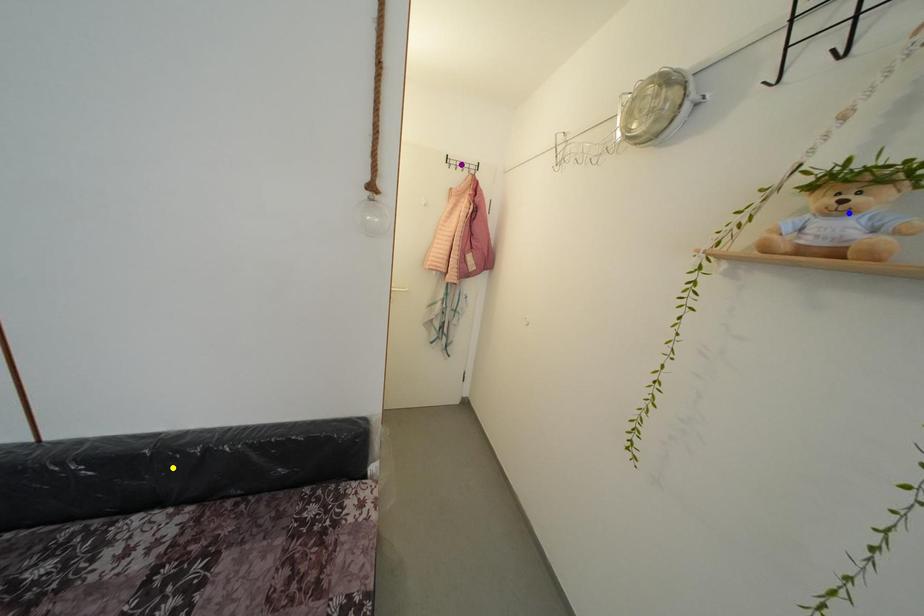
Order these from nearest to farthest:
A) yellow point
B) blue point
C) purple point

blue point → yellow point → purple point